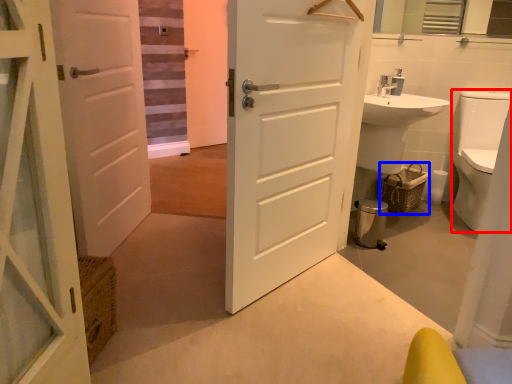
Question: Which object appears closest to the camera in this image, toilet bowl (highlighted by a red box) or basket (highlighted by a blue box)?

Choices:
 (A) toilet bowl
 (B) basket

Answer: (A)